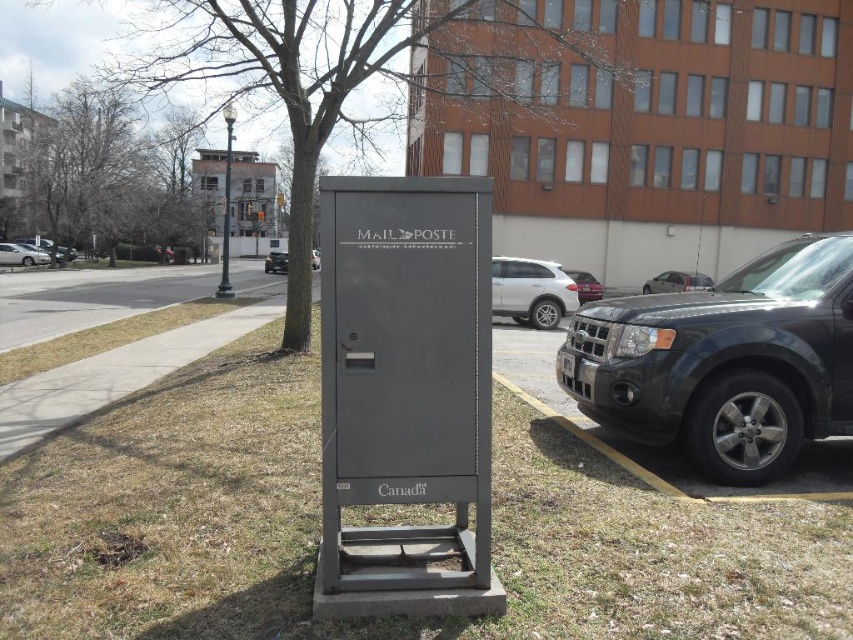
Question: Considering the real-world distances, which object is closest to the metallic gray mailbox at center?

Choices:
 (A) silver metallic sedan at right
 (B) matte black suv at right

Answer: (B)

Question: Estimate the real-world distances between objects in this image. Which object is farther from the bare branches at upper left?

Choices:
 (A) gray concrete sidewalk at lower left
 (B) silver metallic sedan at left
 (C) metallic gray mailbox at center
 (D) green leafless tree at center

Answer: (C)

Question: From the image, what is the correct spatial relationship of bare branches at upper left in relation to silver metallic sedan at right?

Choices:
 (A) above
 (B) below

Answer: (A)

Question: Where is green leafless tree at center located in relation to white matte suv at center in the image?

Choices:
 (A) above
 (B) below

Answer: (A)

Question: Estimate the real-world distances between objects in this image. Which object is farther from the bare branches at upper left?

Choices:
 (A) silver metallic sedan at right
 (B) silver metallic sedan at left
 (C) white matte suv at center
 (D) gray concrete sidewalk at lower left

Answer: (A)

Question: Does gray concrete sidewalk at lower left appear under white matte suv at center?

Choices:
 (A) no
 (B) yes

Answer: (A)